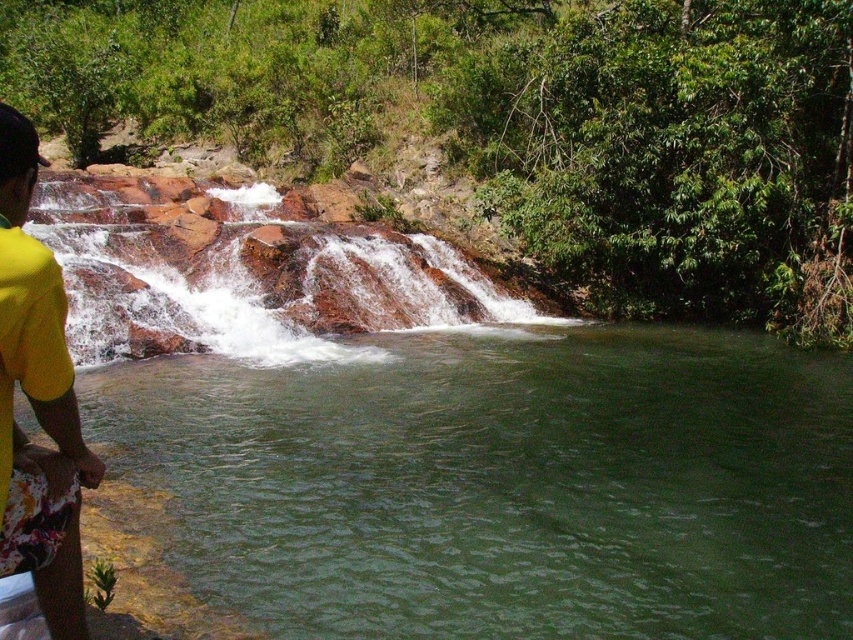
Between point (260, 589) and point (39, 570), which one is positioned behind?

The point (260, 589) is more distant.

Looking at this image, is the position of green smooth river at lower left less distant than that of yellow fabric shorts at lower left?

That is False.

Does point (668, 490) come behind point (39, 516)?

Yes, point (668, 490) is farther from viewer.

Identify the location of green smooth river at lower left. This screenshot has height=640, width=853. (497, 483).

Can you confirm if green smooth river at lower left is positioned to the left of rusty rock waterfall at center?

No, green smooth river at lower left is not to the left of rusty rock waterfall at center.

Which of these two, green smooth river at lower left or rusty rock waterfall at center, stands shorter?

green smooth river at lower left

Between point (341, 628) and point (270, 237), which one is positioned behind?

Positioned behind is point (270, 237).

Identify the location of green smooth river at lower left. (497, 483).

What do you see at coordinates (252, 282) in the screenshot? Image resolution: width=853 pixels, height=640 pixels. I see `rusty rock waterfall at center` at bounding box center [252, 282].

Does rusty rock waterfall at center lie behind yellow fabric shorts at lower left?

Yes, rusty rock waterfall at center is further from the viewer.

Which is behind, point (128, 188) or point (19, 125)?

Point (128, 188)

At what (x,y) coordinates should I click in order to perform the action: click on rusty rock waterfall at center. Please return your answer as a coordinate pair (x, y). Looking at the image, I should click on (252, 282).